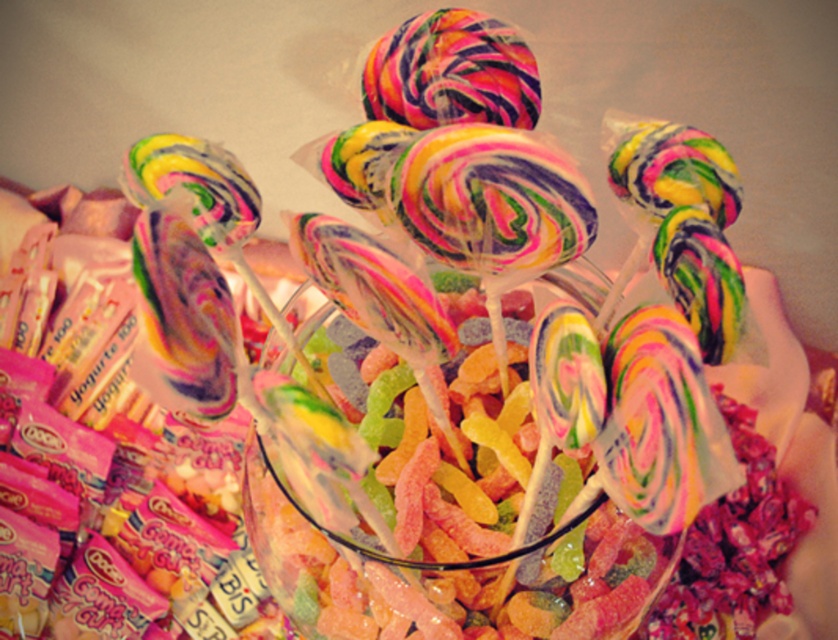
You are a child trying to reach the rainbow swirl lollipop at center inside the transparent glass bowl at center. Considering the height difference between the bowl and the lollipop, will you be able to see the top of the lollipop?

The transparent glass bowl at center is taller than the rainbow swirl lollipop at center, so the bowl might block the view of the lollipop top depending on its position inside.

You are a customer at a candy store and see the transparent glass bowl at center and the rainbow swirl lollipop at center. Which one is positioned to the right side?

The transparent glass bowl at center is positioned to the right of the rainbow swirl lollipop at center.